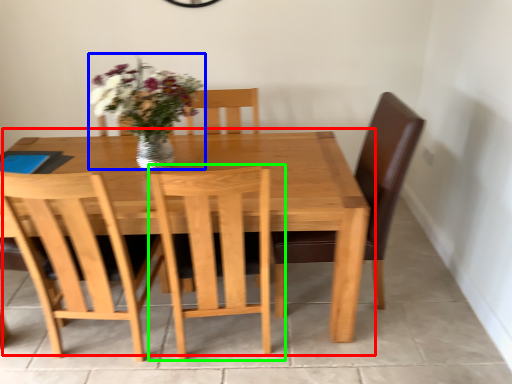
Question: Based on their relative distances, which object is nearer to kitchen & dining room table (highlighted by a red box)? Choose from floral arrangement (highlighted by a blue box) and chair (highlighted by a green box).

Choices:
 (A) floral arrangement
 (B) chair

Answer: (B)